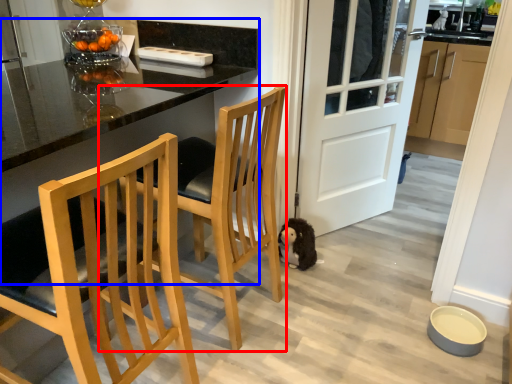
Question: Which object is further to the camera taking this photo, chair (highlighted by a red box) or table (highlighted by a blue box)?

Choices:
 (A) chair
 (B) table

Answer: (A)